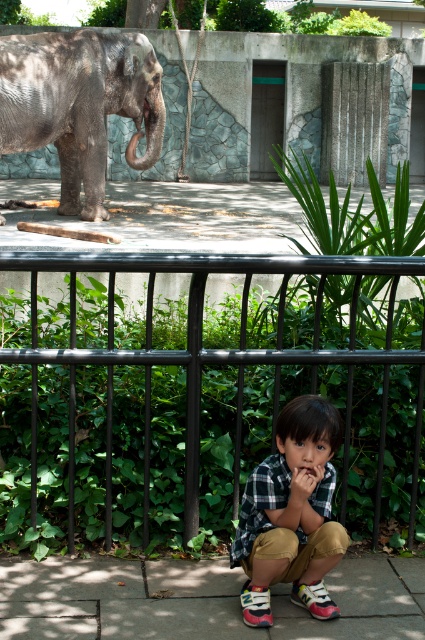
Question: Does black metal fence at center appear on the right side of plaid fabric shirt at center?

Choices:
 (A) yes
 (B) no

Answer: (B)

Question: Is black metal fence at center closer to camera compared to pink matte lips at center?

Choices:
 (A) yes
 (B) no

Answer: (B)

Question: Can you confirm if plaid fabric shirt at center is positioned to the right of pink matte lips at center?

Choices:
 (A) no
 (B) yes

Answer: (A)

Question: Which object is farther from the camera taking this photo?

Choices:
 (A) gray textured elephant at upper left
 (B) plaid fabric shirt at center
 (C) black metal fence at center
 (D) pink matte lips at center

Answer: (A)

Question: Which point is farther from the camera taking this photo?

Choices:
 (A) (146, 164)
 (B) (294, 576)
 (C) (138, 397)
 (D) (306, 468)

Answer: (A)

Question: Which point is farther to the camera?

Choices:
 (A) pink matte lips at center
 (B) gray textured elephant at upper left

Answer: (B)